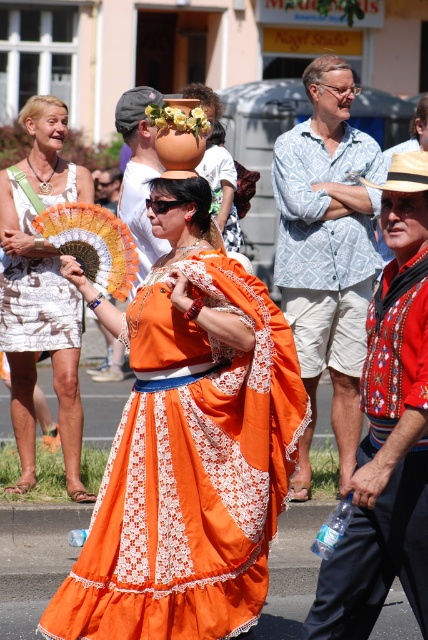
Who is higher up, light blue patterned shirt at center or matte white hat at center?

Positioned higher is matte white hat at center.

At what (x,y) coordinates should I click in order to perform the action: click on light blue patterned shirt at center. Please return your answer as a coordinate pair (x, y). Looking at the image, I should click on (326, 252).

Is point (160, 378) positioned before point (11, 237)?

Yes, point (160, 378) is in front of point (11, 237).

Is orange fabric dress at center to the left of white lace dress at left from the viewer's perspective?

No, orange fabric dress at center is not to the left of white lace dress at left.

Who is more forward, (273, 340) or (17, 355)?

Point (273, 340)

The width and height of the screenshot is (428, 640). What are the coordinates of `orange fabric dress at center` in the screenshot? It's located at (187, 445).

Can you confirm if light blue patterned shirt at center is taller than white printed fabric dress at left?

Correct, light blue patterned shirt at center is much taller as white printed fabric dress at left.

Image resolution: width=428 pixels, height=640 pixels. Identify the location of light blue patterned shirt at center. (326, 252).